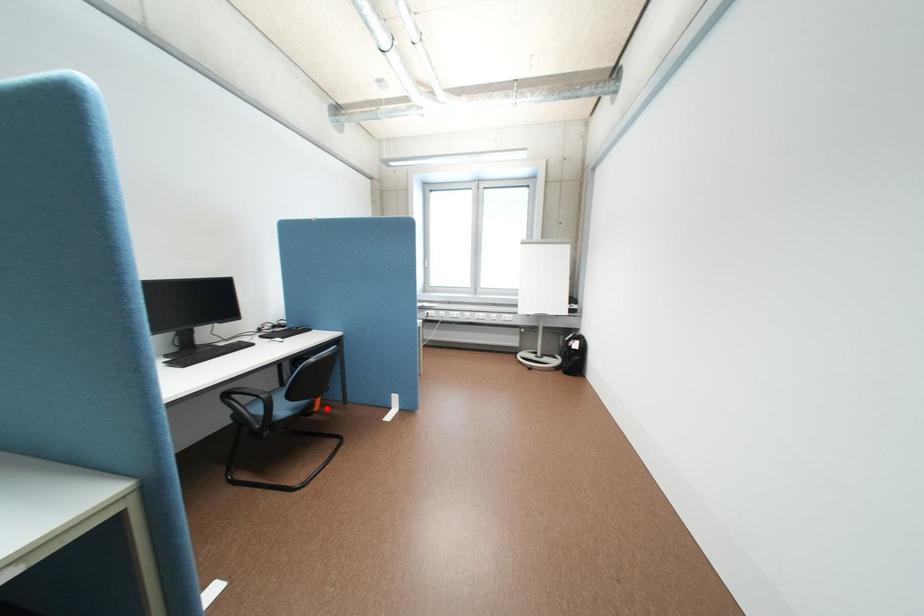
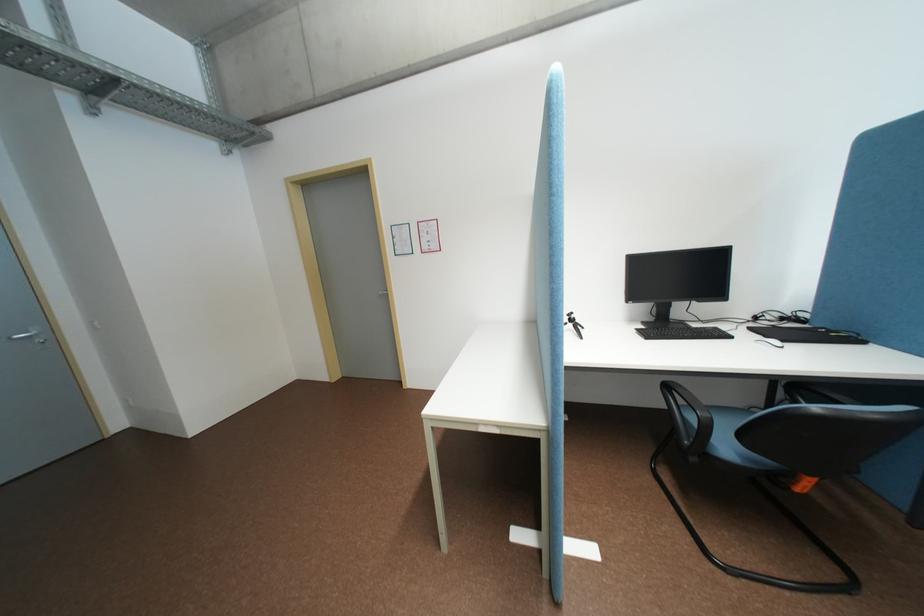
Find the pixel in the second image that matches the highlighted location in the first image.

(808, 488)